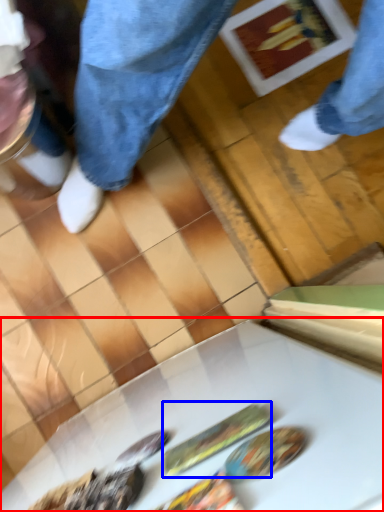
Question: Which point is further to the camera, table (highlighted by a red box) or food (highlighted by a blue box)?

Choices:
 (A) table
 (B) food

Answer: (B)